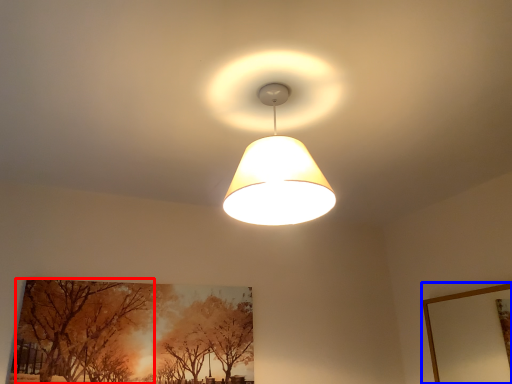
Question: Which of the following is the farthest to the observer, tree (highlighted by a red box) or picture frame (highlighted by a blue box)?

Choices:
 (A) tree
 (B) picture frame

Answer: (A)